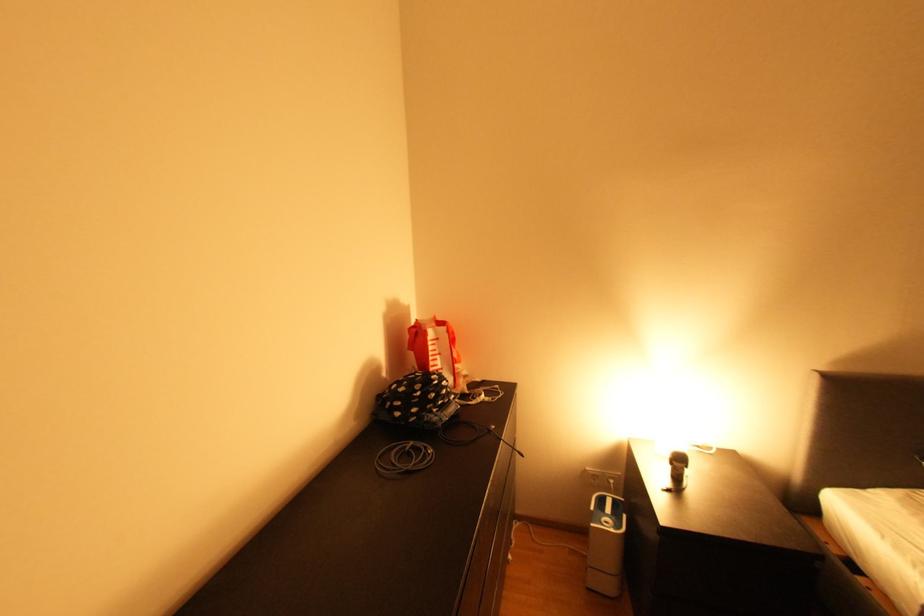
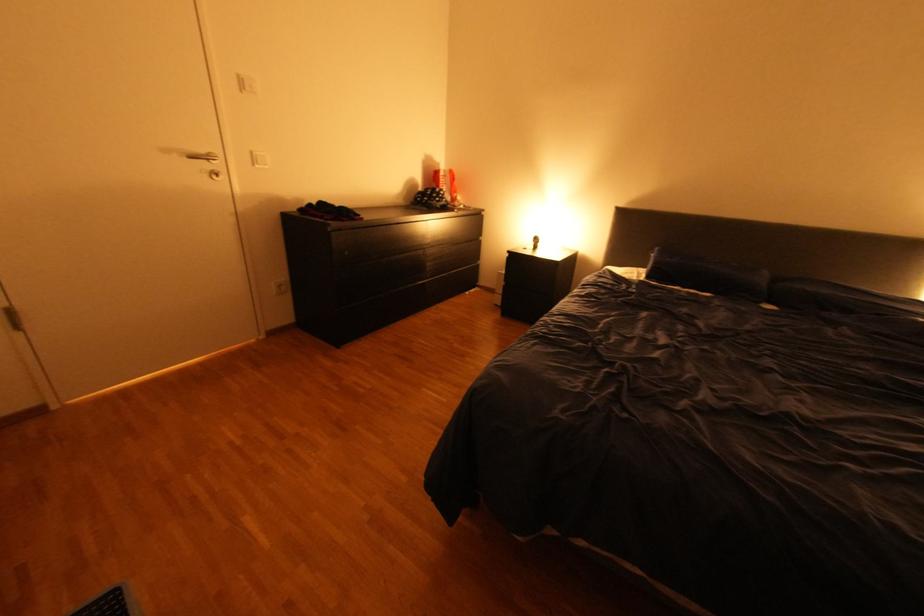
Where in the second image is the point corresponding to [457,389] from the first image?

(454, 196)